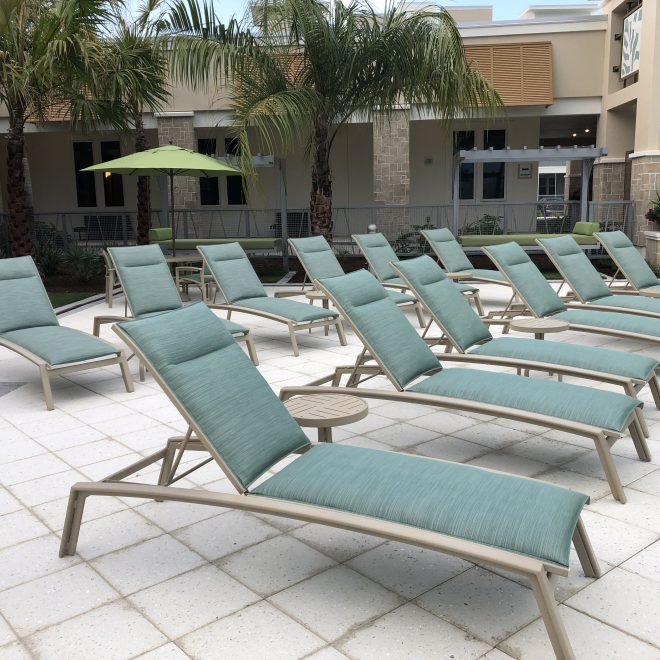
This screenshot has height=660, width=660. I want to click on doors, so click(478, 177), click(222, 185), click(100, 187).